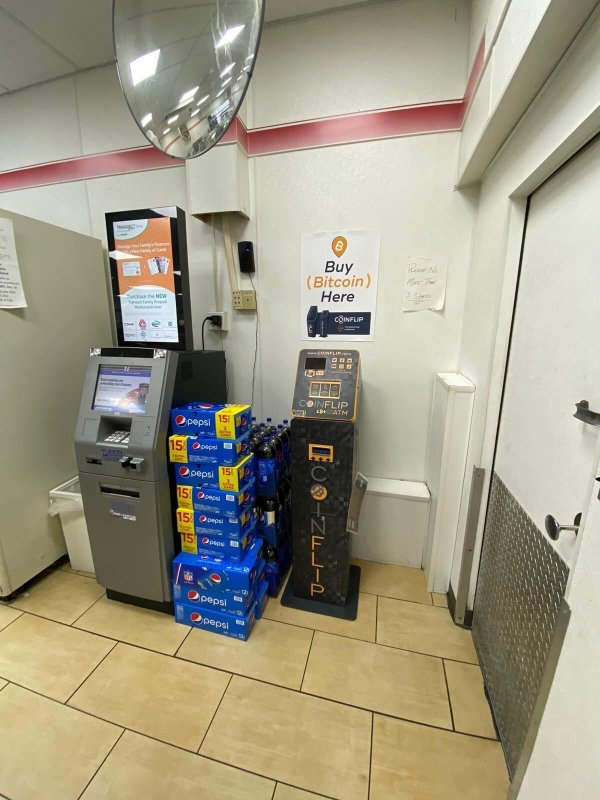
Locate an element on the screen. Image resolution: width=600 pixels, height=800 pixels. temp wall is located at coordinates (21, 378).